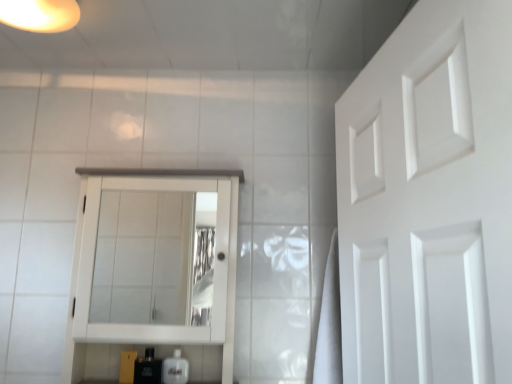
Question: Can you confirm if white wood medicine cabinet at center is positioned to the right of translucent plastic soap at lower center, the 1th toiletry positioned from the right?

Choices:
 (A) yes
 (B) no

Answer: (B)

Question: Can you see white wood medicine cabinet at center touching translucent plastic soap at lower center, the 2th toiletry viewed from the left?

Choices:
 (A) no
 (B) yes

Answer: (A)

Question: Does white wood medicine cabinet at center contain translucent plastic soap at lower center, the 1th toiletry positioned from the right?

Choices:
 (A) no
 (B) yes

Answer: (B)

Question: Is white wood medicine cabinet at center thinner than translucent plastic soap at lower center, the 2th toiletry viewed from the left?

Choices:
 (A) no
 (B) yes

Answer: (A)

Question: Is white wood medicine cabinet at center far from translucent plastic soap at lower center, the 2th toiletry viewed from the left?

Choices:
 (A) no
 (B) yes

Answer: (A)

Question: From a real-world perspective, is white wood medicine cabinet at center physically above translucent plastic soap at lower center, the 2th toiletry viewed from the left?

Choices:
 (A) yes
 (B) no

Answer: (A)

Question: From the image's perspective, is white wood medicine cabinet at center below matte yellow light fixture at upper left?

Choices:
 (A) no
 (B) yes

Answer: (B)

Question: Is white wood medicine cabinet at center wider than matte yellow light fixture at upper left?

Choices:
 (A) no
 (B) yes

Answer: (A)

Question: Considering the relative positions of white wood medicine cabinet at center and matte yellow light fixture at upper left in the image provided, is white wood medicine cabinet at center to the right of matte yellow light fixture at upper left from the viewer's perspective?

Choices:
 (A) no
 (B) yes

Answer: (B)

Question: From the image's perspective, is white wood medicine cabinet at center on top of matte yellow light fixture at upper left?

Choices:
 (A) yes
 (B) no

Answer: (B)

Question: Is white wood medicine cabinet at center further to the viewer compared to matte yellow light fixture at upper left?

Choices:
 (A) yes
 (B) no

Answer: (A)

Question: Is white wood medicine cabinet at center positioned beyond the bounds of matte yellow light fixture at upper left?

Choices:
 (A) yes
 (B) no

Answer: (A)

Question: Considering the relative sizes of translucent plastic soap at lower center, the 2th toiletry viewed from the left, and black glossy bottle at lower left, which ranks as the second toiletry in right-to-left order, in the image provided, is translucent plastic soap at lower center, the 2th toiletry viewed from the left, smaller than black glossy bottle at lower left, which ranks as the second toiletry in right-to-left order,?

Choices:
 (A) yes
 (B) no

Answer: (A)